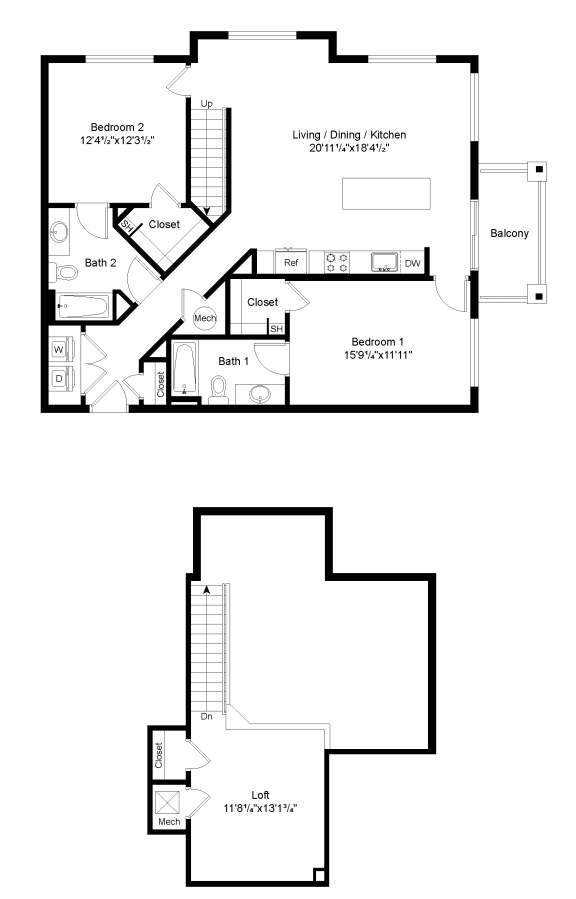
Find the location of `windows/glass`. windows/glass is located at coordinates (476, 336), (471, 243), (469, 100), (391, 58), (250, 36), (124, 54).